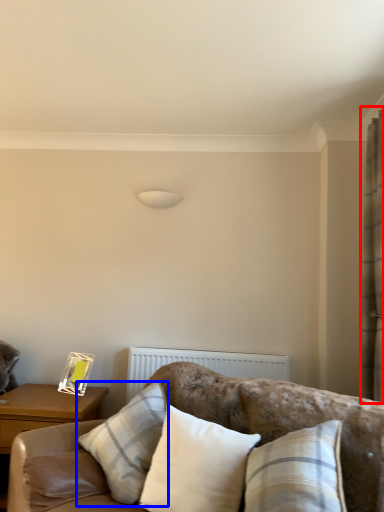
Question: Which of the following is the closest to the observer, curtain (highlighted by a red box) or pillow (highlighted by a blue box)?

Choices:
 (A) curtain
 (B) pillow

Answer: (B)